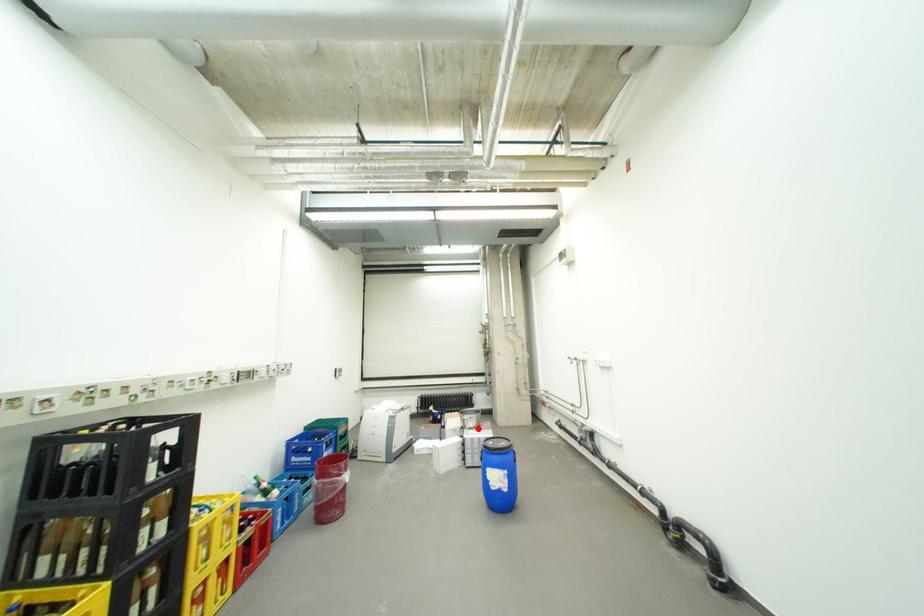
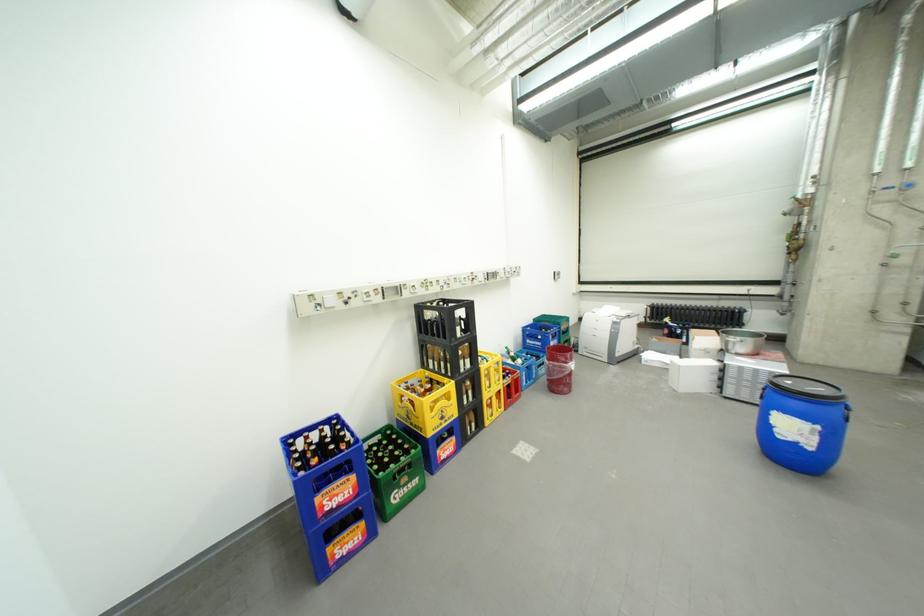
Question: I am providing you with two images of the same scene from different viewpoints. Image1 has a red point marked. In image2, the corresponding 3D location appears at what relative position? Reply with the corresponding letter.

Choices:
 (A) Closer
 (B) Farther

Answer: (B)